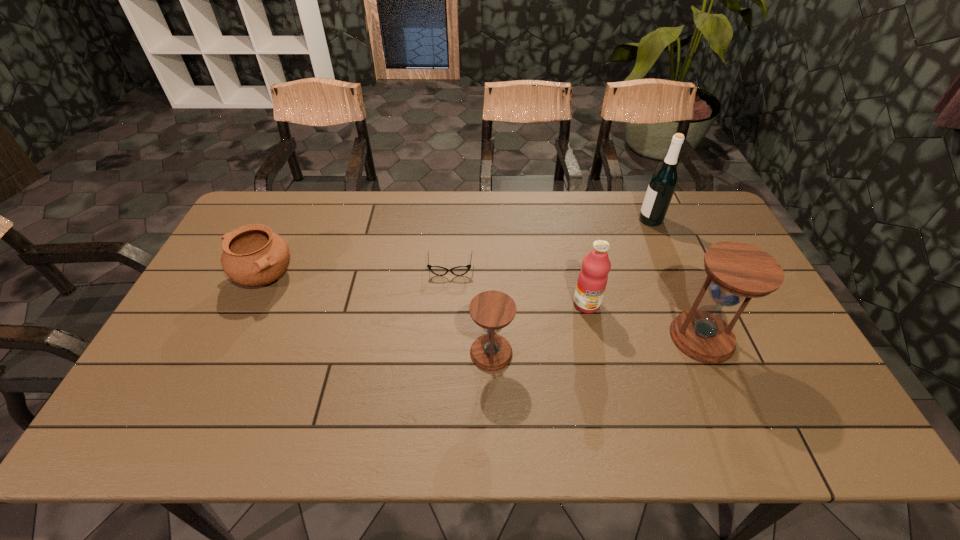
Identify the location of vacant area that lies between the farthest object and the left hourglass. Image resolution: width=960 pixels, height=540 pixels. (571, 286).

The image size is (960, 540). Identify the location of empty space that is in between the fourth object from left to right and the shortest object. (518, 287).

You are a GUI agent. You are given a task and a screenshot of the screen. Output one action in this format:
    pyautogui.click(x=<x>, y=<y>)
    Task: Click on the free space between the farthest object and the third tallest object
    The height and width of the screenshot is (540, 960).
    Given the screenshot: What is the action you would take?
    pyautogui.click(x=618, y=262)

Image resolution: width=960 pixels, height=540 pixels. I want to click on vacant space that is in between the third tallest object and the second tallest object, so click(x=644, y=321).

Locate which object is the second closest to the farthest object. Please provide its 2D coordinates. Your answer should be formatted as a tuple, i.e. [(x, y)], where the tuple contains the x and y coordinates of a point satisfying the conditions above.

[(735, 271)]

Select which object is the fourth closest to the taller hourglass. Please provide its 2D coordinates. Your answer should be formatted as a tuple, i.e. [(x, y)], where the tuple contains the x and y coordinates of a point satisfying the conditions above.

[(437, 270)]

This screenshot has height=540, width=960. I want to click on free space that satisfies the following two spatial constraints: 1. on the label of the wine bottle; 2. on the back side of the right hourglass, so click(701, 338).

Where is `vacant space that satisfies the following two spatial constraints: 1. on the label of the wine bottle; 2. on the label of the fourth object from left to right`? The height and width of the screenshot is (540, 960). vacant space that satisfies the following two spatial constraints: 1. on the label of the wine bottle; 2. on the label of the fourth object from left to right is located at coordinates (686, 304).

Locate an element on the screen. free location that satisfies the following two spatial constraints: 1. on the front side of the right hourglass; 2. on the right side of the leftmost object is located at coordinates (236, 338).

The height and width of the screenshot is (540, 960). In order to click on free location that satisfies the following two spatial constraints: 1. on the label of the taller hourglass; 2. on the right side of the tallest object in this screenshot , I will do `click(701, 338)`.